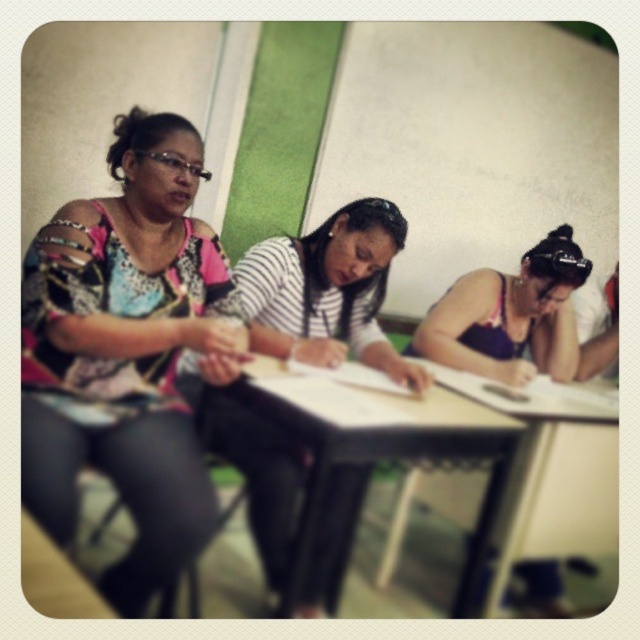
Is point (124, 128) closer to camera compared to point (307, 556)?

That is False.

Is multicolored printed blouse at left closer to the viewer compared to black plastic table at center?

Yes.

Describe the element at coordinates (125, 352) in the screenshot. I see `multicolored printed blouse at left` at that location.

Identify the location of multicolored printed blouse at left. (125, 352).

Is multicolored printed blouse at left further to camera compared to striped fabric shirt at center?

No, it is not.

Can you confirm if multicolored printed blouse at left is bigger than striped fabric shirt at center?

Yes.

This screenshot has width=640, height=640. I want to click on multicolored printed blouse at left, so click(x=125, y=352).

Consider the image. Can you confirm if striped fabric shirt at center is positioned to the left of purple fabric hairband at center?

Indeed, striped fabric shirt at center is positioned on the left side of purple fabric hairband at center.

Does striped fabric shirt at center appear over purple fabric hairband at center?

No.

Is point (259, 326) farther from camera compared to point (541, 344)?

No, (259, 326) is in front of (541, 344).

Identify the location of striped fabric shirt at center. This screenshot has width=640, height=640. (328, 291).